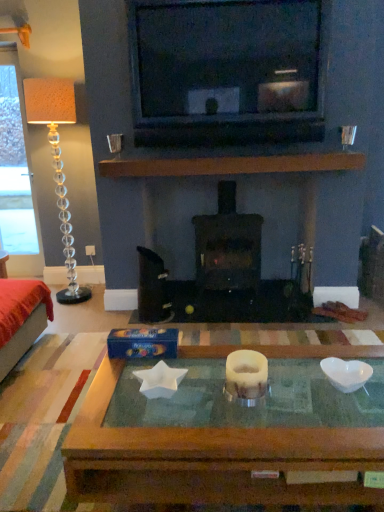
You are a GUI agent. You are given a task and a screenshot of the screen. Output one action in this format:
    pyautogui.click(x=<x>, y=<y>)
    Task: Click on the translucent glass floor lamp at left
    This screenshot has height=512, width=384.
    Given the screenshot: What is the action you would take?
    pyautogui.click(x=57, y=163)

What do you see at coordinates (21, 318) in the screenshot? I see `velvet red ottoman at left` at bounding box center [21, 318].

Image resolution: width=384 pixels, height=512 pixels. Identify the location of translucent glass coffee table at center. (230, 434).

From the image's perspective, would you say black matte wood burning stove at center is shown under translucent glass floor lamp at left?

Correct, black matte wood burning stove at center appears lower than translucent glass floor lamp at left in the image.

Between black matte wood burning stove at center and translucent glass floor lamp at left, which one has more height?

translucent glass floor lamp at left is taller.

Is black matte wood burning stove at center further to the viewer compared to translucent glass floor lamp at left?

Yes, black matte wood burning stove at center is further from the camera.

Does black matte wood burning stove at center have a greater width compared to translucent glass floor lamp at left?

Correct, the width of black matte wood burning stove at center exceeds that of translucent glass floor lamp at left.

Between point (269, 424) and point (2, 325), which one is positioned behind?

The point (2, 325) is farther.

Does translucent glass coffee table at center appear on the right side of velvet red ottoman at left?

Yes.

Between translucent glass coffee table at center and velvet red ottoman at left, which one is positioned behind?

velvet red ottoman at left is more distant.

From a real-world perspective, is translucent glass coffee table at center over velvet red ottoman at left?

No, from a real-world perspective, translucent glass coffee table at center is not above velvet red ottoman at left.

Is translucent glass coffee table at center inside black matte wood burning stove at center?

No, black matte wood burning stove at center does not contain translucent glass coffee table at center.

Considering the positions of objects black matte wood burning stove at center and translucent glass coffee table at center in the image provided, who is more to the right, black matte wood burning stove at center or translucent glass coffee table at center?

black matte wood burning stove at center.

From a real-world perspective, which object stands above the other?

black matte wood burning stove at center.

Is point (233, 205) closer or farther from the camera than point (375, 445)?

Point (233, 205) appears to be farther away from the viewer than point (375, 445).

Is translucent glass floor lamp at left facing towards translucent glass coffee table at center?

No, translucent glass floor lamp at left is not oriented towards translucent glass coffee table at center.

Which is farther from the camera, (26,115) or (236,405)?

The point (26,115) is more distant.

Is translucent glass floor lamp at left not inside translucent glass coffee table at center?

Absolutely, translucent glass floor lamp at left is external to translucent glass coffee table at center.

Which of these two, translucent glass floor lamp at left or velvet red ottoman at left, is smaller?

velvet red ottoman at left is smaller.

Which of these two, translucent glass floor lamp at left or velvet red ottoman at left, is thinner?

With smaller width is translucent glass floor lamp at left.

From a real-world perspective, is translucent glass floor lamp at left above or below velvet red ottoman at left?

translucent glass floor lamp at left is situated higher than velvet red ottoman at left in the real world.

Looking at this image, which point is more distant from viewer, (66, 115) or (29, 287)?

The point (66, 115) is more distant.

Is point (296, 500) behind point (246, 264)?

No, it is not.

Does translucent glass coffee table at center touch black matte wood burning stove at center?

No, translucent glass coffee table at center is not with black matte wood burning stove at center.

How many degrees apart are the facing directions of translucent glass coffee table at center and black matte wood burning stove at center?

They differ by 90.9 degrees in their facing directions.

Considering the relative sizes of translucent glass coffee table at center and black matte wood burning stove at center in the image provided, is translucent glass coffee table at center wider than black matte wood burning stove at center?

Correct, the width of translucent glass coffee table at center exceeds that of black matte wood burning stove at center.

Is the surface of velvet red ottoman at left in direct contact with translucent glass floor lamp at left?

No, velvet red ottoman at left is not next to translucent glass floor lamp at left.

What's the angular difference between velvet red ottoman at left and translucent glass floor lamp at left's facing directions?

They differ by 88.7 degrees in their facing directions.

In the image, is velvet red ottoman at left positioned in front of or behind translucent glass floor lamp at left?

velvet red ottoman at left is in front of translucent glass floor lamp at left.

Which is correct: velvet red ottoman at left is inside translucent glass floor lamp at left, or outside of it?

velvet red ottoman at left is outside translucent glass floor lamp at left.

Identify the location of lamp in front of the black matte wood burning stove at center. This screenshot has width=384, height=512. (57, 163).

I want to click on furniture that appears on the left of translucent glass coffee table at center, so click(x=21, y=318).

Looking at the image, which one is located further to translucent glass floor lamp at left, black matte wood burning stove at center or velvet red ottoman at left?

Among the two, black matte wood burning stove at center is located further to translucent glass floor lamp at left.

From the image, which object appears to be nearer to black matte wood burning stove at center, translucent glass coffee table at center or velvet red ottoman at left?

velvet red ottoman at left.

Looking at the image, which one is located closer to translucent glass coffee table at center, translucent glass floor lamp at left or velvet red ottoman at left?

velvet red ottoman at left.

Estimate the real-world distances between objects in this image. Which object is further from translucent glass floor lamp at left, translucent glass coffee table at center or black matte wood burning stove at center?

The object further to translucent glass floor lamp at left is translucent glass coffee table at center.

Consider the image. Looking at the image, which one is located further to translucent glass floor lamp at left, black matte wood burning stove at center or translucent glass coffee table at center?

translucent glass coffee table at center.

Based on their spatial positions, is black matte wood burning stove at center or translucent glass floor lamp at left closer to velvet red ottoman at left?

translucent glass floor lamp at left is positioned closer to the anchor velvet red ottoman at left.

Looking at the image, which one is located further to black matte wood burning stove at center, velvet red ottoman at left or translucent glass coffee table at center?

Result: Among the two, translucent glass coffee table at center is located further to black matte wood burning stove at center.

Estimate the real-world distances between objects in this image. Which object is closer to black matte wood burning stove at center, translucent glass floor lamp at left or translucent glass coffee table at center?

translucent glass floor lamp at left is closer to black matte wood burning stove at center.

What are the coordinates of `lamp between velvet red ottoman at left and black matte wood burning stove at center in the horizontal direction` in the screenshot? It's located at (57, 163).

Where is `lamp between translucent glass coffee table at center and black matte wood burning stove at center along the z-axis`? lamp between translucent glass coffee table at center and black matte wood burning stove at center along the z-axis is located at coordinates (57, 163).

At what (x,y) coordinates should I click in order to perform the action: click on furniture located between translucent glass coffee table at center and translucent glass floor lamp at left in the depth direction. Please return your answer as a coordinate pair (x, y). This screenshot has width=384, height=512. Looking at the image, I should click on (21, 318).

The height and width of the screenshot is (512, 384). Identify the location of furniture between translucent glass coffee table at center and black matte wood burning stove at center in the front-back direction. (21, 318).